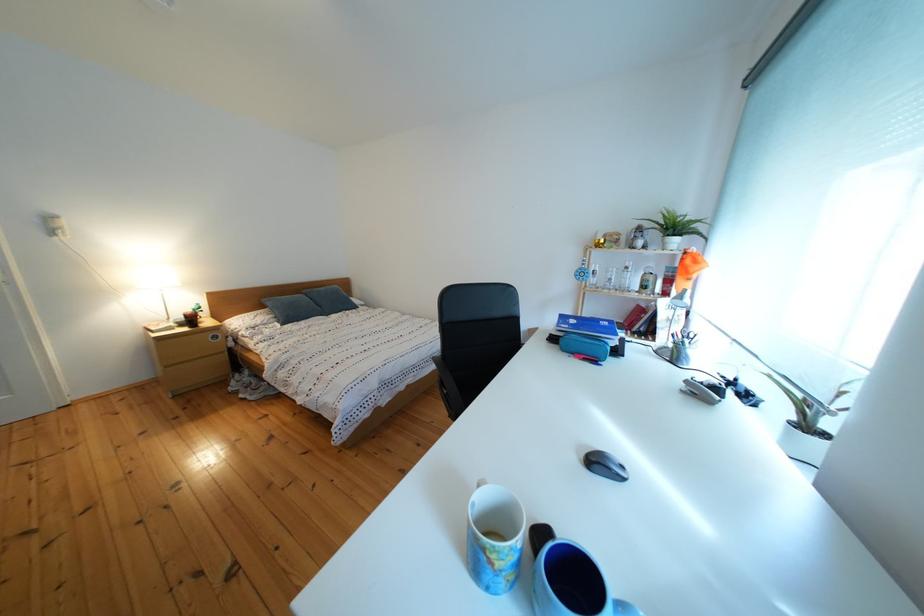
Where is `black chair seat`? The height and width of the screenshot is (616, 924). black chair seat is located at coordinates (475, 339).